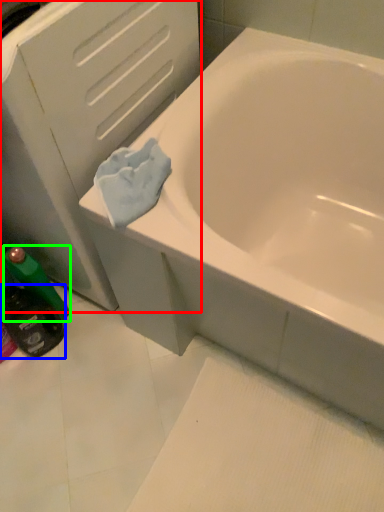
Question: Based on their relative distances, which object is nearer to file cabinet (highlighted by a red box)? Choose from mouthwash (highlighted by a blue box) and mouthwash (highlighted by a green box).

Choices:
 (A) mouthwash
 (B) mouthwash

Answer: (B)